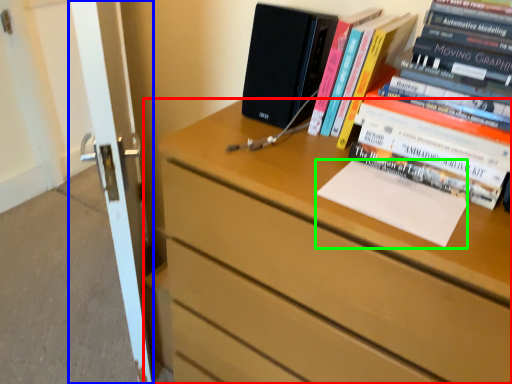
Question: Considering the real-world distances, which object is closest to chest of drawers (highlighted by a red box)? screen door (highlighted by a blue box) or paperback book (highlighted by a green box).

Choices:
 (A) screen door
 (B) paperback book

Answer: (B)